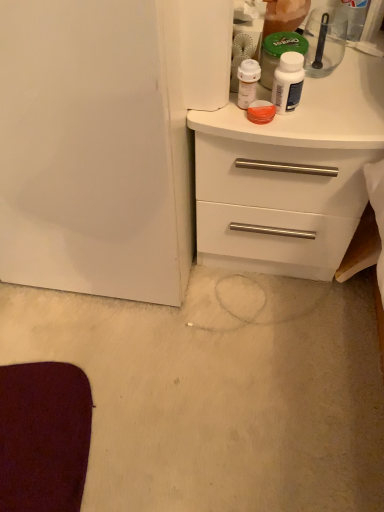
Question: Considering the relative sizes of transparent plastic spoon at upper right and white glossy bottle at upper right in the image provided, is transparent plastic spoon at upper right taller than white glossy bottle at upper right?

Choices:
 (A) yes
 (B) no

Answer: (A)

Question: Considering the relative positions of transparent plastic spoon at upper right and white glossy bottle at upper right in the image provided, is transparent plastic spoon at upper right behind white glossy bottle at upper right?

Choices:
 (A) yes
 (B) no

Answer: (A)

Question: From the image's perspective, is transparent plastic spoon at upper right on top of white glossy bottle at upper right?

Choices:
 (A) no
 (B) yes

Answer: (B)

Question: Is transparent plastic spoon at upper right thinner than white glossy bottle at upper right?

Choices:
 (A) yes
 (B) no

Answer: (B)

Question: Is transparent plastic spoon at upper right completely or partially outside of white glossy bottle at upper right?

Choices:
 (A) yes
 (B) no

Answer: (A)

Question: Based on their sizes in the image, would you say white matte chest of drawers at upper right is bigger or smaller than transparent plastic spoon at upper right?

Choices:
 (A) small
 (B) big

Answer: (B)

Question: From the image's perspective, is white matte chest of drawers at upper right positioned above or below transparent plastic spoon at upper right?

Choices:
 (A) above
 (B) below

Answer: (B)

Question: In terms of width, does white matte chest of drawers at upper right look wider or thinner when compared to transparent plastic spoon at upper right?

Choices:
 (A) thin
 (B) wide

Answer: (B)

Question: Choose the correct answer: Is white matte chest of drawers at upper right inside transparent plastic spoon at upper right or outside it?

Choices:
 (A) inside
 (B) outside

Answer: (B)

Question: From a real-world perspective, is transparent plastic spoon at upper right physically located above or below white matte chest of drawers at upper right?

Choices:
 (A) above
 (B) below

Answer: (A)

Question: Which is correct: transparent plastic spoon at upper right is inside white matte chest of drawers at upper right, or outside of it?

Choices:
 (A) outside
 (B) inside

Answer: (A)

Question: Considering the positions of point (311, 25) and point (322, 154), is point (311, 25) closer or farther from the camera than point (322, 154)?

Choices:
 (A) closer
 (B) farther

Answer: (B)

Question: In terms of width, does transparent plastic spoon at upper right look wider or thinner when compared to white matte chest of drawers at upper right?

Choices:
 (A) thin
 (B) wide

Answer: (A)

Question: From the image's perspective, relative to white glossy bottle at upper right, is white matte chest of drawers at upper right above or below?

Choices:
 (A) below
 (B) above

Answer: (A)

Question: Considering the relative positions of white matte chest of drawers at upper right and white glossy bottle at upper right in the image provided, is white matte chest of drawers at upper right to the left or to the right of white glossy bottle at upper right?

Choices:
 (A) right
 (B) left

Answer: (A)